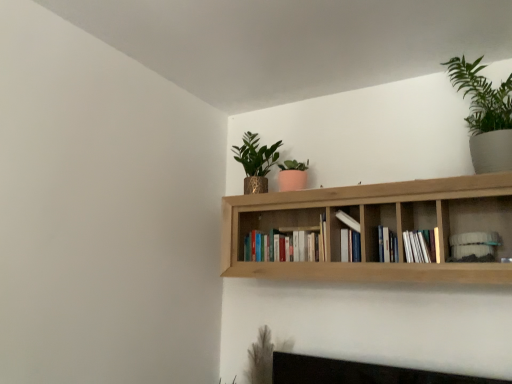
What do you see at coordinates (374, 227) in the screenshot? I see `natural wood bookshelf at upper center` at bounding box center [374, 227].

What is the approximate height of natural wood bookshelf at upper center?

The height of natural wood bookshelf at upper center is 42.57 centimeters.

How much space does white paper book at center, marked as the third book in a right-to-left arrangement, occupy horizontally?

The width of white paper book at center, marked as the third book in a right-to-left arrangement, is 6.47 inches.

The width and height of the screenshot is (512, 384). What do you see at coordinates (350, 237) in the screenshot? I see `white paper book at center, the second book when ordered from left to right` at bounding box center [350, 237].

Measure the distance between white matte bookshelf at upper right, the 5th book in the left-to-right sequence, and camera.

The depth of white matte bookshelf at upper right, the 5th book in the left-to-right sequence, is 5.97 feet.

Where is `hardcover books at center, which appears as the fifth book when viewed from the right`? hardcover books at center, which appears as the fifth book when viewed from the right is located at coordinates (283, 246).

This screenshot has height=384, width=512. Find the location of `natural wood bookshelf at upper center`. natural wood bookshelf at upper center is located at coordinates (374, 227).

Which is in front, white paper book at center, the second book when ordered from left to right, or green matte plant at upper right, which is the second houseplant from left to right?

Positioned in front is green matte plant at upper right, which is the second houseplant from left to right.

Between white paper book at center, the second book when ordered from left to right, and green matte plant at upper right, acting as the 1th houseplant starting from the right, which one appears on the left side from the viewer's perspective?

white paper book at center, the second book when ordered from left to right, is more to the left.

Locate an element on the screen. This screenshot has width=512, height=384. houseplant that appears in front of the white paper book at center, which is the fourth book from right to left is located at coordinates (485, 115).

Which object is thinner, white paper book at center, the second book when ordered from left to right, or green matte plant at upper right, which is the second houseplant from left to right?

white paper book at center, the second book when ordered from left to right, is thinner.

Does matte gold pot at upper center, the 1th houseplant in the left-to-right sequence, turn towards green matte plant at upper right, the 2th houseplant viewed from the back?

No.

Between matte gold pot at upper center, the 1th houseplant in the left-to-right sequence, and green matte plant at upper right, the 2th houseplant viewed from the back, which one appears on the left side from the viewer's perspective?

From the viewer's perspective, matte gold pot at upper center, the 1th houseplant in the left-to-right sequence, appears more on the left side.

Does matte gold pot at upper center, the second houseplant in the front-to-back sequence, have a greater height compared to green matte plant at upper right, acting as the 1th houseplant starting from the right?

Incorrect, the height of matte gold pot at upper center, the second houseplant in the front-to-back sequence, is not larger of that of green matte plant at upper right, acting as the 1th houseplant starting from the right.

Would you say green matte plant at upper right, the 2th houseplant viewed from the back, is part of matte gold pot at upper center, the second houseplant in the front-to-back sequence,'s contents?

Definitely not — green matte plant at upper right, the 2th houseplant viewed from the back, is not inside matte gold pot at upper center, the second houseplant in the front-to-back sequence.

Is green matte plant at upper right, which is the second houseplant from left to right, bigger or smaller than natural wood bookshelf at upper center?

Considering their sizes, green matte plant at upper right, which is the second houseplant from left to right, takes up less space than natural wood bookshelf at upper center.

From a real-world perspective, does green matte plant at upper right, acting as the 1th houseplant starting from the right, sit lower than natural wood bookshelf at upper center?

Actually, green matte plant at upper right, acting as the 1th houseplant starting from the right, is physically above natural wood bookshelf at upper center in the real world.

Which is more to the right, green matte plant at upper right, which is the second houseplant from left to right, or natural wood bookshelf at upper center?

From the viewer's perspective, green matte plant at upper right, which is the second houseplant from left to right, appears more on the right side.

The height and width of the screenshot is (384, 512). In order to click on houseplant that is the 2nd object above the natural wood bookshelf at upper center (from a real-world perspective) in this screenshot , I will do `click(485, 115)`.

Looking at this image, from the image's perspective, is white paper book at center, the second book when ordered from left to right, above or below white matte bookshelf at upper right, the 5th book in the left-to-right sequence?

Clearly, from the image's perspective, white paper book at center, the second book when ordered from left to right, is above white matte bookshelf at upper right, the 5th book in the left-to-right sequence.

Are white paper book at center, which is the fourth book from right to left, and white matte bookshelf at upper right, the 1th book viewed from the right, beside each other?

No, white paper book at center, which is the fourth book from right to left, is not touching white matte bookshelf at upper right, the 1th book viewed from the right.

Which point is more distant from viewer, (342, 246) or (483, 241)?

Positioned behind is point (342, 246).

Considering the relative sizes of white paper book at center, which is the fourth book from right to left, and white matte bookshelf at upper right, the 1th book viewed from the right, in the image provided, is white paper book at center, which is the fourth book from right to left, smaller than white matte bookshelf at upper right, the 1th book viewed from the right,?

No.

Consider the image. Is white paper book at center, which appears as the third book when viewed from the left, positioned beyond the bounds of white paper book at center-right, the second book when ordered from right to left?

white paper book at center, which appears as the third book when viewed from the left, lies outside white paper book at center-right, the second book when ordered from right to left,'s area.

Where is `the 2nd book behind the white paper book at center-right, the second book when ordered from right to left`? The height and width of the screenshot is (384, 512). the 2nd book behind the white paper book at center-right, the second book when ordered from right to left is located at coordinates (387, 245).

Can you confirm if white paper book at center, which appears as the third book when viewed from the left, is bigger than white paper book at center-right, arranged as the 4th book when viewed from the left?

Incorrect, white paper book at center, which appears as the third book when viewed from the left, is not larger than white paper book at center-right, arranged as the 4th book when viewed from the left.

Is white matte bookshelf at upper right, the 1th book viewed from the right, oriented away from white paper book at center, the second book when ordered from left to right?

No, white matte bookshelf at upper right, the 1th book viewed from the right, is not facing away from white paper book at center, the second book when ordered from left to right.

Based on their positions, is white matte bookshelf at upper right, the 5th book in the left-to-right sequence, located to the left or right of white paper book at center, the second book when ordered from left to right?

In the image, white matte bookshelf at upper right, the 5th book in the left-to-right sequence, appears on the right side of white paper book at center, the second book when ordered from left to right.

What's the angular difference between white matte bookshelf at upper right, the 5th book in the left-to-right sequence, and white paper book at center, the second book when ordered from left to right,'s facing directions?

There is a 2.44-degree angle between the facing directions of white matte bookshelf at upper right, the 5th book in the left-to-right sequence, and white paper book at center, the second book when ordered from left to right.

Consider the image. Would you say white matte bookshelf at upper right, the 5th book in the left-to-right sequence, is outside white paper book at center, which is the fourth book from right to left?

white matte bookshelf at upper right, the 5th book in the left-to-right sequence, is positioned outside white paper book at center, which is the fourth book from right to left.

This screenshot has height=384, width=512. Identify the location of the 4th book to the right when counting from the hardcover books at center, which is the first book from left to right. (473, 244).

Considering the relative sizes of white matte bookshelf at upper right, the 1th book viewed from the right, and hardcover books at center, which is the first book from left to right, in the image provided, is white matte bookshelf at upper right, the 1th book viewed from the right, smaller than hardcover books at center, which is the first book from left to right,?

Yes.

Which is in front, white matte bookshelf at upper right, the 1th book viewed from the right, or hardcover books at center, which appears as the fifth book when viewed from the right?

white matte bookshelf at upper right, the 1th book viewed from the right, is closer to the camera.

Identify the location of the 4th book behind the green matte plant at upper right, the 2th houseplant viewed from the back. (350, 237).

Where is `houseplant located above the matte gold pot at upper center, placed as the second houseplant when sorted from right to left (from a real-world perspective)`? houseplant located above the matte gold pot at upper center, placed as the second houseplant when sorted from right to left (from a real-world perspective) is located at coordinates (485, 115).

Estimate the real-world distances between objects in this image. Which object is further from matte gold pot at upper center, which ranks as the first houseplant in back-to-front order, green matte plant at upper right, which is the second houseplant from left to right, or white paper book at center, the second book when ordered from left to right?

The object further to matte gold pot at upper center, which ranks as the first houseplant in back-to-front order, is green matte plant at upper right, which is the second houseplant from left to right.

Looking at the image, which one is located further to matte gold pot at upper center, which ranks as the first houseplant in back-to-front order, white matte bookshelf at upper right, the 5th book in the left-to-right sequence, or white paper book at center-right, arranged as the 4th book when viewed from the left?

white matte bookshelf at upper right, the 5th book in the left-to-right sequence, is positioned further to the anchor matte gold pot at upper center, which ranks as the first houseplant in back-to-front order.

Based on their spatial positions, is natural wood bookshelf at upper center or matte gold pot at upper center, the 1th houseplant in the left-to-right sequence, closer to white paper book at center, which is the fourth book from right to left?

natural wood bookshelf at upper center.

When comparing their distances from natural wood bookshelf at upper center, does white matte bookshelf at upper right, the 1th book viewed from the right, or white paper book at center, which appears as the third book when viewed from the left, seem closer?

white paper book at center, which appears as the third book when viewed from the left, is positioned closer to the anchor natural wood bookshelf at upper center.

Based on their spatial positions, is hardcover books at center, which is the first book from left to right, or natural wood bookshelf at upper center closer to green matte plant at upper right, acting as the 1th houseplant starting from the right?

natural wood bookshelf at upper center lies closer to green matte plant at upper right, acting as the 1th houseplant starting from the right, than the other object.

Estimate the real-world distances between objects in this image. Which object is further from white paper book at center, which is the fourth book from right to left, hardcover books at center, which is the first book from left to right, or matte gold pot at upper center, which ranks as the first houseplant in back-to-front order?

Based on the image, matte gold pot at upper center, which ranks as the first houseplant in back-to-front order, appears to be further to white paper book at center, which is the fourth book from right to left.

Based on their spatial positions, is white paper book at center-right, the second book when ordered from right to left, or matte gold pot at upper center, the 1th houseplant in the left-to-right sequence, further from white matte bookshelf at upper right, the 1th book viewed from the right?

matte gold pot at upper center, the 1th houseplant in the left-to-right sequence.

Consider the image. Which object lies nearer to the anchor point white paper book at center, which appears as the third book when viewed from the left, white matte bookshelf at upper right, the 5th book in the left-to-right sequence, or white paper book at center, which is the fourth book from right to left?

The object closer to white paper book at center, which appears as the third book when viewed from the left, is white paper book at center, which is the fourth book from right to left.

At what (x,y) coordinates should I click in order to perform the action: click on shelf between matte gold pot at upper center, the 1th houseplant in the left-to-right sequence, and white matte bookshelf at upper right, the 1th book viewed from the right. Please return your answer as a coordinate pair (x, y). This screenshot has width=512, height=384. Looking at the image, I should click on (374, 227).

The image size is (512, 384). Identify the location of shelf situated between hardcover books at center, which appears as the fifth book when viewed from the right, and white paper book at center-right, arranged as the 4th book when viewed from the left, from left to right. (374, 227).

Identify the location of book between white paper book at center, the second book when ordered from left to right, and white paper book at center-right, the second book when ordered from right to left. This screenshot has height=384, width=512. (387, 245).

Where is `shelf between matte gold pot at upper center, placed as the second houseplant when sorted from right to left, and white paper book at center-right, the second book when ordered from right to left, in the horizontal direction`? The height and width of the screenshot is (384, 512). shelf between matte gold pot at upper center, placed as the second houseplant when sorted from right to left, and white paper book at center-right, the second book when ordered from right to left, in the horizontal direction is located at coordinates (374, 227).